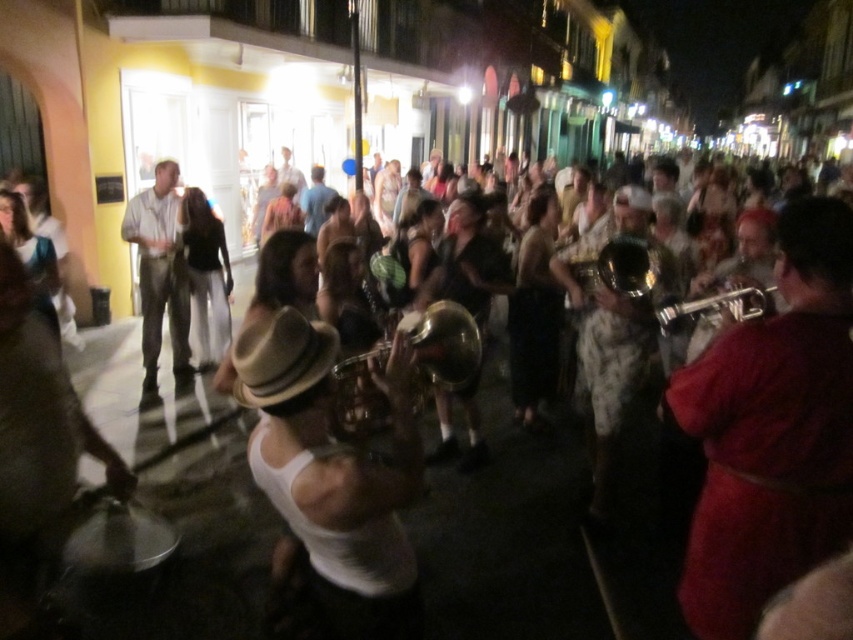
Question: Among these objects, which one is nearest to the camera?

Choices:
 (A) light brown corduroy pants at left
 (B) shiny red trumpet at center
 (C) shiny brass trumpet at center
 (D) shiny brass trumpet at center right

Answer: (B)

Question: Considering the real-world distances, which object is farthest from the patterned fabric pants at center?

Choices:
 (A) white matte tank top at center
 (B) blue denim shirt at center

Answer: (B)

Question: Is shiny red trumpet at center positioned behind patterned fabric pants at center?

Choices:
 (A) yes
 (B) no

Answer: (B)

Question: Does light brown corduroy pants at left appear on the left side of shiny gold trumpet at center?

Choices:
 (A) no
 (B) yes

Answer: (B)

Question: Which object appears closest to the camera in this image?

Choices:
 (A) light brown corduroy pants at left
 (B) shiny brass trumpet at center right
 (C) shiny gold trumpet at center
 (D) white matte tank top at center

Answer: (D)

Question: Can you confirm if white matte tank top at center is positioned to the right of shiny brass trumpet at center?

Choices:
 (A) yes
 (B) no

Answer: (B)